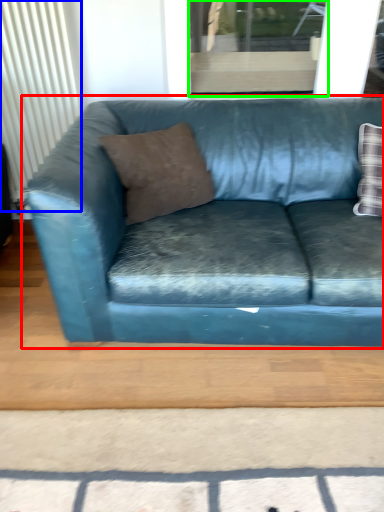
Question: Considering the real-world distances, which object is closest to studio couch (highlighted by a red box)? radiator (highlighted by a blue box) or window (highlighted by a green box).

Choices:
 (A) radiator
 (B) window

Answer: (B)